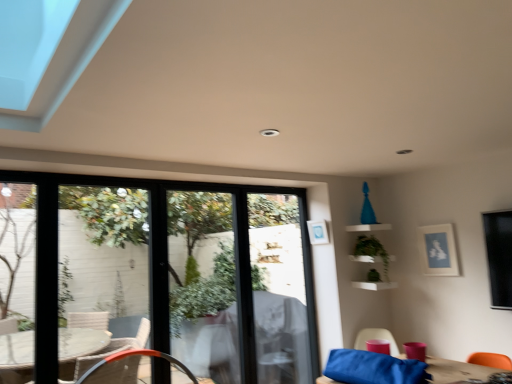
Question: From the image's perspective, is green matte plant at upper right located above or below matte blue picture frame at upper right, the second picture frame positioned from the left?

Choices:
 (A) above
 (B) below

Answer: (B)

Question: Which is correct: green matte plant at upper right is inside matte blue picture frame at upper right, the second picture frame positioned from the left, or outside of it?

Choices:
 (A) inside
 (B) outside

Answer: (B)

Question: Estimate the real-world distances between objects in this image. Which object is closer to the transparent glass window at center?

Choices:
 (A) matte blue picture frame at upper right, the first picture frame in the right-to-left sequence
 (B) clear glass door at center
 (C) white wicker chair at lower left, the second chair in the right-to-left sequence
 (D) green matte plant at upper right
 (E) matte pink cup at lower right, the 2th chair from the left

Answer: (B)

Question: Considering the real-world distances, which object is closest to the white wicker chair at lower left, the second chair in the right-to-left sequence?

Choices:
 (A) matte pink cup at lower right, which is the first chair in right-to-left order
 (B) matte blue picture frame at upper right, the first picture frame in the right-to-left sequence
 (C) transparent glass window at center
 (D) matte white picture frame at upper center, the first picture frame viewed from the left
 (E) green matte plant at upper right

Answer: (C)